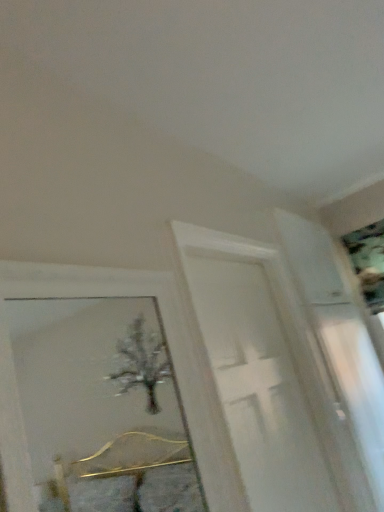
What do you see at coordinates (255, 368) in the screenshot?
I see `white glossy screen door at center` at bounding box center [255, 368].

At what (x,y) coordinates should I click in order to perform the action: click on white glossy screen door at center. Please return your answer as a coordinate pair (x, y). The width and height of the screenshot is (384, 512). Looking at the image, I should click on [255, 368].

The height and width of the screenshot is (512, 384). What do you see at coordinates (368, 262) in the screenshot?
I see `metallic silver picture frame at upper right` at bounding box center [368, 262].

This screenshot has width=384, height=512. What are the coordinates of `metallic silver picture frame at upper right` in the screenshot? It's located at tap(368, 262).

At what (x,y) coordinates should I click in order to perform the action: click on white glossy screen door at center. Please return your answer as a coordinate pair (x, y). Image resolution: width=384 pixels, height=512 pixels. Looking at the image, I should click on point(255,368).

Based on their positions, is white glossy screen door at center located to the left or right of metallic silver picture frame at upper right?

Clearly, white glossy screen door at center is on the left of metallic silver picture frame at upper right in the image.

Looking at this image, between white glossy screen door at center and metallic silver picture frame at upper right, which one is positioned in front?

white glossy screen door at center is in front.

Considering the positions of points (331, 500) and (378, 269), is point (331, 500) closer to camera compared to point (378, 269)?

Yes, it is in front of point (378, 269).

From the image's perspective, between white glossy screen door at center and metallic silver picture frame at upper right, who is located below?

white glossy screen door at center is shown below in the image.

Looking at this image, from a real-world perspective, between white glossy screen door at center and metallic silver picture frame at upper right, who is vertically lower?

In real-world perspective, white glossy screen door at center is lower.

Considering the sizes of objects white glossy screen door at center and metallic silver picture frame at upper right in the image provided, who is wider, white glossy screen door at center or metallic silver picture frame at upper right?

With larger width is metallic silver picture frame at upper right.

In terms of height, does white glossy screen door at center look taller or shorter compared to metallic silver picture frame at upper right?

Considering their sizes, white glossy screen door at center has more height than metallic silver picture frame at upper right.

Can you confirm if white glossy screen door at center is bigger than metallic silver picture frame at upper right?

Indeed, white glossy screen door at center has a larger size compared to metallic silver picture frame at upper right.

Is white glossy screen door at center completely or partially outside of metallic silver picture frame at upper right?

Yes, white glossy screen door at center is outside of metallic silver picture frame at upper right.

Is white glossy screen door at center positioned far away from metallic silver picture frame at upper right?

white glossy screen door at center is positioned a significant distance from metallic silver picture frame at upper right.

Consider the image. Is white glossy screen door at center positioned with its back to metallic silver picture frame at upper right?

No, white glossy screen door at center is not facing away from metallic silver picture frame at upper right.

What's the angular difference between white glossy screen door at center and metallic silver picture frame at upper right's facing directions?

There is a 90.3-degree angle between the facing directions of white glossy screen door at center and metallic silver picture frame at upper right.

How much distance is there between white glossy screen door at center and metallic silver picture frame at upper right?

→ They are 4.42 feet apart.

At what (x,y) coordinates should I click in order to perform the action: click on screen door on the left of metallic silver picture frame at upper right. Please return your answer as a coordinate pair (x, y). Looking at the image, I should click on (255, 368).

Between metallic silver picture frame at upper right and white glossy screen door at center, which one appears on the left side from the viewer's perspective?

white glossy screen door at center is more to the left.

Which object is more forward, metallic silver picture frame at upper right or white glossy screen door at center?

white glossy screen door at center is more forward.

Considering the positions of point (357, 265) and point (223, 320), is point (357, 265) closer or farther from the camera than point (223, 320)?

Point (357, 265) appears to be farther away from the viewer than point (223, 320).

From the image's perspective, is metallic silver picture frame at upper right located above or below white glossy screen door at center?

Clearly, from the image's perspective, metallic silver picture frame at upper right is above white glossy screen door at center.

From a real-world perspective, which object stands above the other?

metallic silver picture frame at upper right.

Is metallic silver picture frame at upper right wider or thinner than white glossy screen door at center?

Clearly, metallic silver picture frame at upper right has more width compared to white glossy screen door at center.

Can you confirm if metallic silver picture frame at upper right is shorter than white glossy screen door at center?

Yes.

Considering the relative sizes of metallic silver picture frame at upper right and white glossy screen door at center in the image provided, is metallic silver picture frame at upper right smaller than white glossy screen door at center?

Correct, metallic silver picture frame at upper right occupies less space than white glossy screen door at center.

Is metallic silver picture frame at upper right outside of white glossy screen door at center?

Yes, metallic silver picture frame at upper right is located beyond the bounds of white glossy screen door at center.

Consider the image. Can you see metallic silver picture frame at upper right touching white glossy screen door at center?

No, metallic silver picture frame at upper right is not next to white glossy screen door at center.

Does metallic silver picture frame at upper right turn towards white glossy screen door at center?

Yes, metallic silver picture frame at upper right is aimed at white glossy screen door at center.

Identify the location of picture frame above the white glossy screen door at center (from the image's perspective). This screenshot has height=512, width=384. (368, 262).

Identify the location of picture frame to the right of white glossy screen door at center. (368, 262).

Find the location of a particular element. This screenshot has width=384, height=512. picture frame that is behind the white glossy screen door at center is located at coordinates (368, 262).